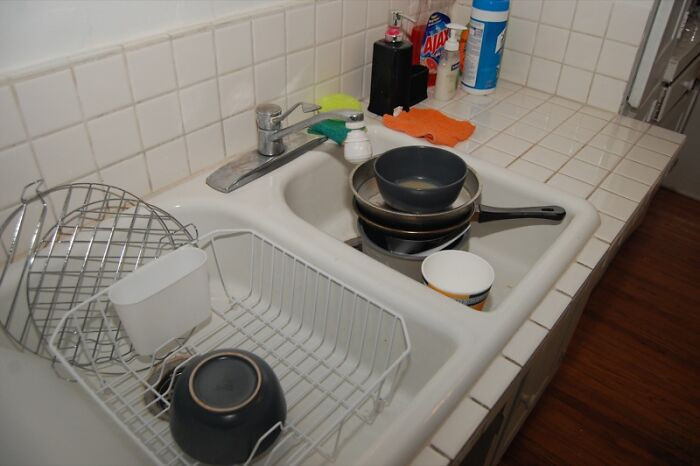
The height and width of the screenshot is (466, 700). Identify the location of wood floor. pos(608,410).